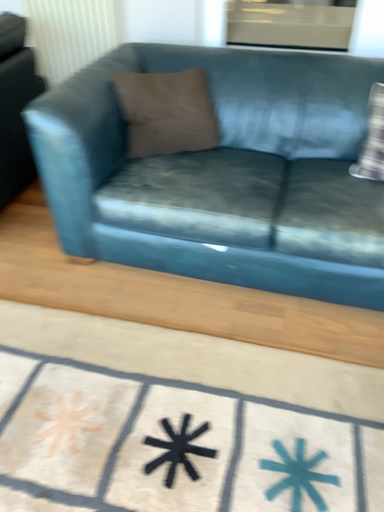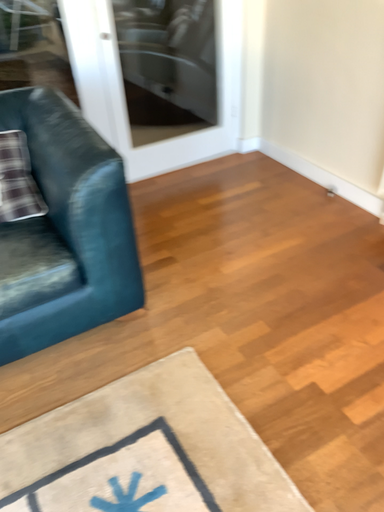
Question: How did the camera likely rotate when shooting the video?

Choices:
 (A) rotated right
 (B) rotated left

Answer: (A)